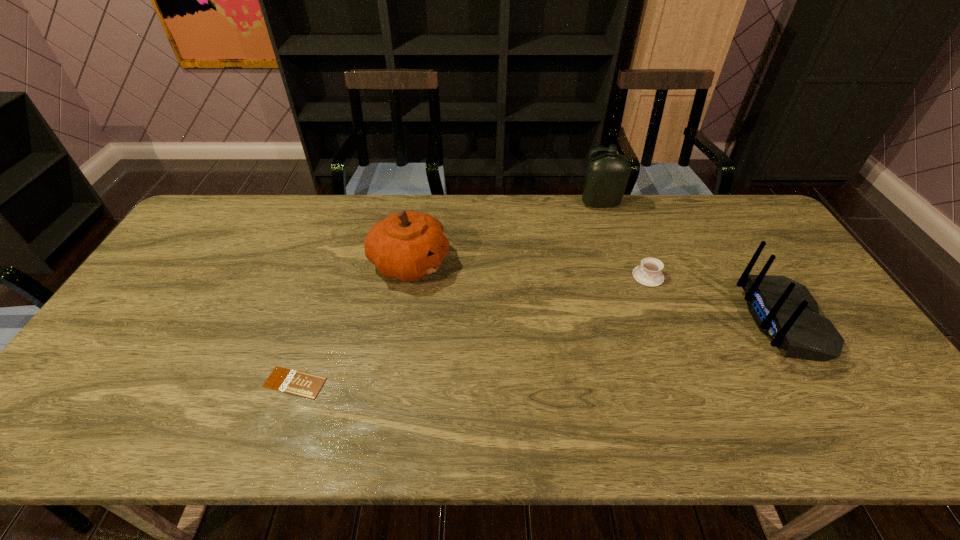
Locate an element on the screen. Image resolution: width=960 pixels, height=540 pixels. vacant space at the left edge of the desktop is located at coordinates (182, 256).

Locate an element on the screen. free location at the far right corner of the desktop is located at coordinates (760, 231).

Locate an element on the screen. free spot between the fourth object from right to left and the rightmost object is located at coordinates (596, 292).

Locate an element on the screen. vacant space in between the bottle and the second shortest object is located at coordinates (624, 240).

Locate an element on the screen. vacant space that's between the shortest object and the bottle is located at coordinates (447, 293).

Find the location of `vacant space that's between the pumpkin and the rightmost object`. vacant space that's between the pumpkin and the rightmost object is located at coordinates (596, 292).

You are a GUI agent. You are given a task and a screenshot of the screen. Output one action in this format:
    pyautogui.click(x=<x>, y=<y>)
    Task: Click on the unoccupied area between the shortest object and the router
    The width and height of the screenshot is (960, 540).
    Given the screenshot: What is the action you would take?
    pyautogui.click(x=540, y=352)

The height and width of the screenshot is (540, 960). What are the coordinates of `vacant area that lies between the shortest object and the fourth tallest object` in the screenshot? It's located at (471, 329).

In order to click on empty space that is in between the second shortest object and the shortest object in this screenshot , I will do `click(471, 329)`.

Where is `empty space between the fourth tallest object and the pumpkin`? This screenshot has height=540, width=960. empty space between the fourth tallest object and the pumpkin is located at coordinates (529, 270).